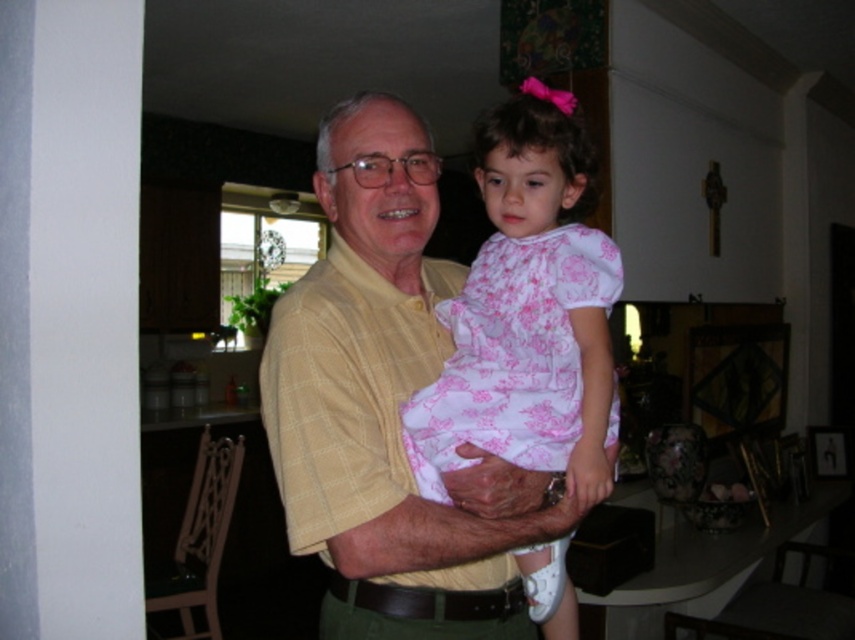
Describe the element at coordinates (386, 406) in the screenshot. I see `yellow checkered shirt at center` at that location.

Where is `yellow checkered shirt at center`? The image size is (855, 640). yellow checkered shirt at center is located at coordinates (386, 406).

Identify the location of yellow checkered shirt at center. The height and width of the screenshot is (640, 855). (386, 406).